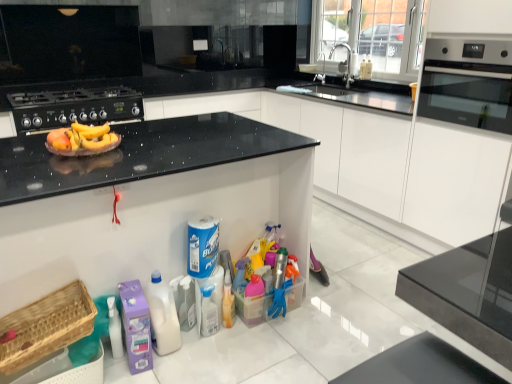
Where is `vacant area in front of yellow matte bananas at center`? vacant area in front of yellow matte bananas at center is located at coordinates pos(44,166).